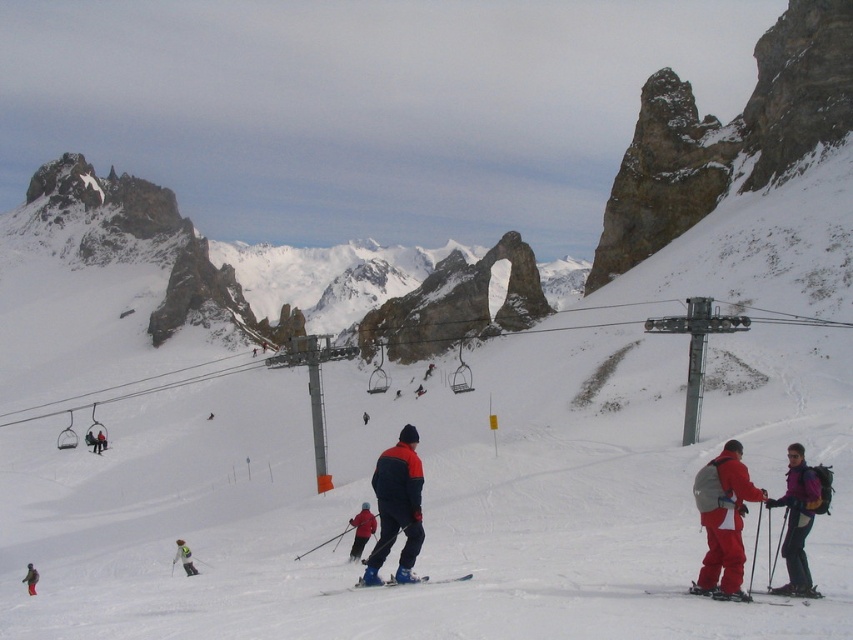
You are a photographer at the ski resort and want to capture both the matte blue ski suit at center and the red ski suit at center in the same frame. Which one of the two suits will appear closer to the camera in your photo?

The matte blue ski suit at center will appear closer to the camera because it is positioned in front of the red ski suit at center.

Looking at this image, you are a photographer standing at the base of the slope and want to capture both the matte black jacket at center and the ski lift chairs in the midground in a single photo. The camera you have can only focus on objects within 300 feet of each other. Will both subjects be in focus?

The matte black jacket at center and the ski lift chairs in the midground are 316.05 feet apart. Since the camera can only focus on objects within 300 feet of each other, the distance between them exceeds the camera range. Therefore, both subjects cannot be in focus simultaneously.